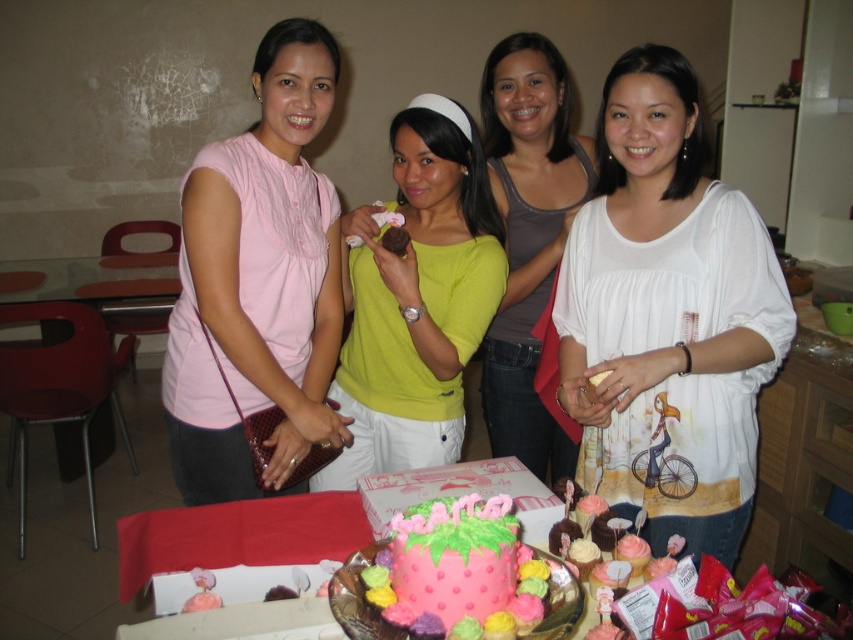
Can you confirm if pink fabric shirt at left is positioned above glasstransparenttable at left?

Incorrect, pink fabric shirt at left is not positioned above glasstransparenttable at left.

Does point (227, 243) come closer to viewer compared to point (94, 465)?

Yes, point (227, 243) is in front of point (94, 465).

What do you see at coordinates (258, 282) in the screenshot? This screenshot has width=853, height=640. I see `pink fabric shirt at left` at bounding box center [258, 282].

Locate an element on the screen. This screenshot has width=853, height=640. pink fabric shirt at left is located at coordinates (258, 282).

Which is below, white cotton blouse at center or pink frosted cake at center?

pink frosted cake at center is below.

Is white cotton blouse at center in front of pink frosted cake at center?

No, it is behind pink frosted cake at center.

Does point (653, 129) lie in front of point (465, 612)?

No, (653, 129) is behind (465, 612).

Where is `white cotton blouse at center`? The width and height of the screenshot is (853, 640). white cotton blouse at center is located at coordinates (666, 316).

Is pink fabric shirt at left smaller than matte white blouse at center?

Yes.

Consider the image. Is pink fabric shirt at left closer to camera compared to matte white blouse at center?

Yes, pink fabric shirt at left is closer to the viewer.

In order to click on pink fabric shirt at left in this screenshot , I will do `click(258, 282)`.

Find the location of a particular element. The image size is (853, 640). pink fabric shirt at left is located at coordinates (258, 282).